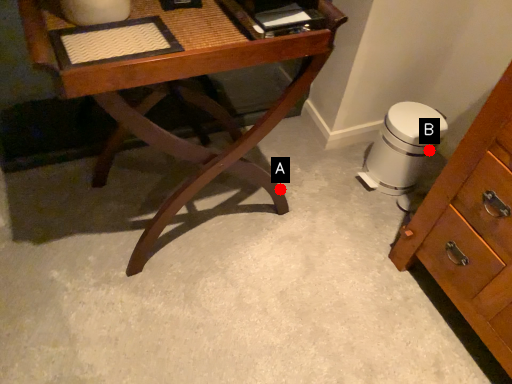
Question: Two points are circled on the image, labeled by A and B beside each circle. Which point appears farthest from the camera in this image?

Choices:
 (A) A is further
 (B) B is further

Answer: (B)